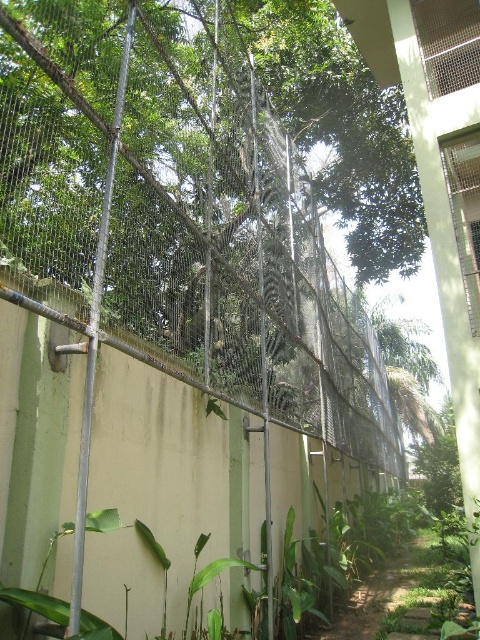
You are standing on the dirt path at lower center and want to reach the green leafy tree at right. Which direction should you walk to get closer to the tree?

You should walk towards the right direction to reach the green leafy tree at right since it is located at the right side of the dirt path at lower center.

You are standing at the entrance of the building and want to walk along the dirt path at lower center towards the green leafy tree at right. Which direction should you turn to reach the tree?

The dirt path at lower center is to the left of green leafy tree at right, so you should turn to the right to reach the tree.

You are standing at the entrance of the building and want to walk towards the green leafy tree at right. Which direction should you move relative to the dirt path at lower center?

You should move towards the right side of the dirt path at lower center because the green leafy tree at right is located to the right of the dirt path at lower center.